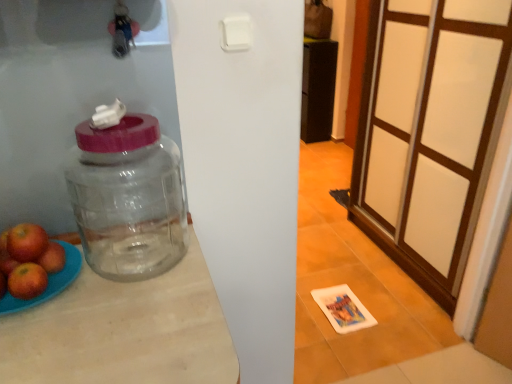
This screenshot has width=512, height=384. I want to click on vacant point to the left of white frosted glass screen door at right, so click(x=346, y=261).